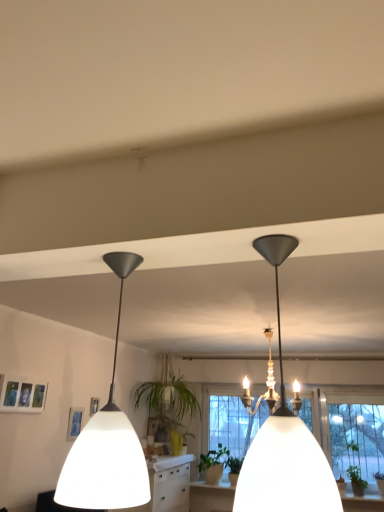
Question: Considering the positions of point (142, 471) and point (205, 465), is point (142, 471) closer or farther from the camera than point (205, 465)?

Choices:
 (A) closer
 (B) farther

Answer: (A)

Question: From the image's perspective, is white matte pendant light at left, the first lamp viewed from the left, located above or below green matte plant at center, the 1th plant from the back?

Choices:
 (A) above
 (B) below

Answer: (A)

Question: Estimate the real-world distances between objects in this image. Which object is closer to the green leafy plant at lower right, the 1th plant when ordered from front to back?

Choices:
 (A) white matte lampshade at center, placed as the second lamp when sorted from left to right
 (B) green leafy plant at center
 (C) white matte pendant light at left, marked as the 2th lamp in a right-to-left arrangement
 (D) green matte plant at center, the 2th plant positioned from the front

Answer: (D)

Question: Which is farther from the white matte pendant light at left, marked as the 2th lamp in a right-to-left arrangement?

Choices:
 (A) green leafy plant at lower right, the 1th plant when ordered from front to back
 (B) green leafy plant at center
 (C) white matte lampshade at center, placed as the second lamp when sorted from left to right
 (D) green matte plant at center, the 1th plant from the back

Answer: (A)